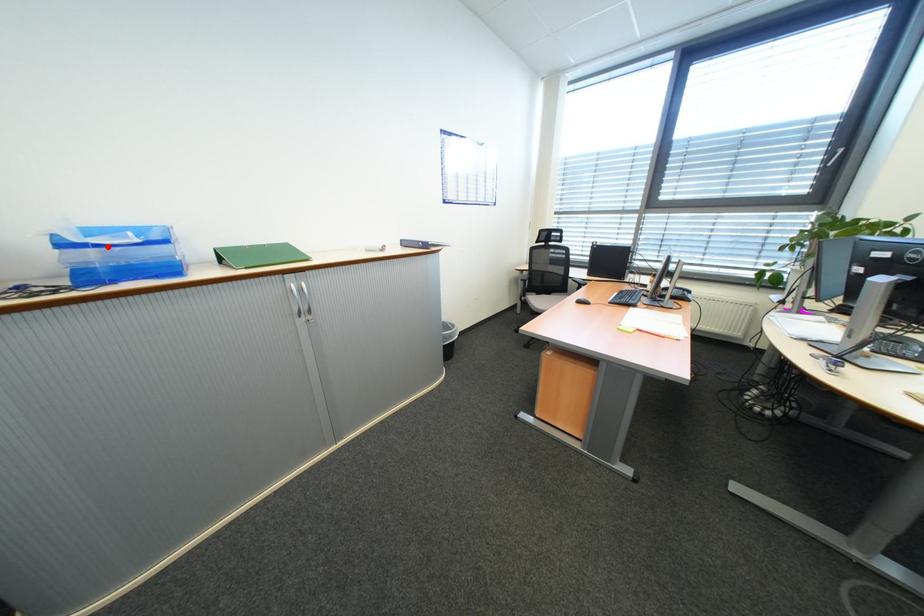
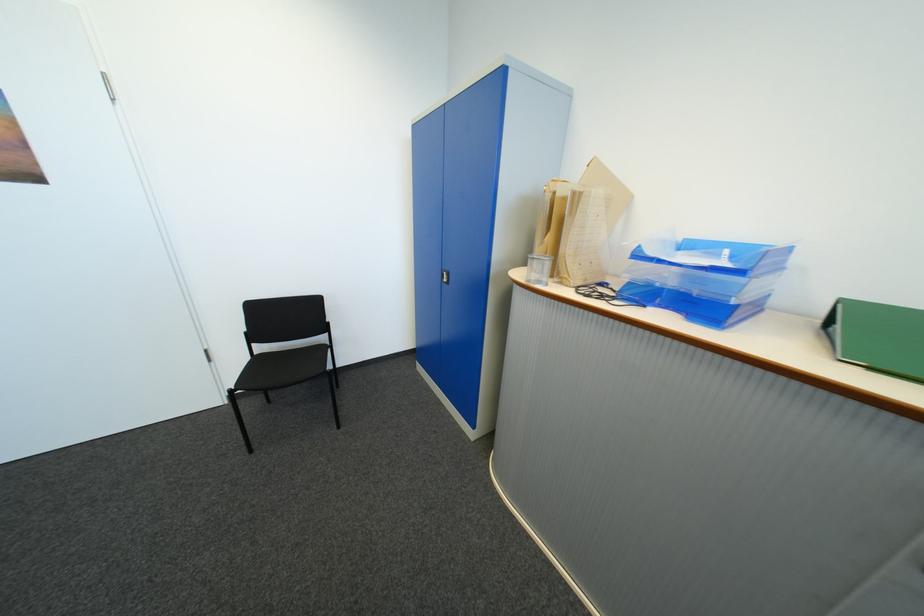
In the second image, find the point that corresponds to the highlighted location in the first image.

(671, 262)